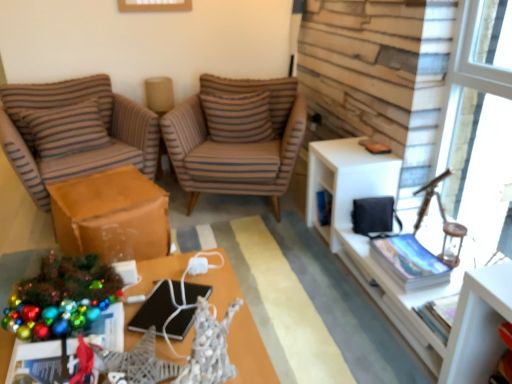
Question: Is brown striped fabric chair at center, arranged as the first chair when viewed from the right, completely or partially inside brown striped pillow at center, the first pillow in the right-to-left sequence?

Choices:
 (A) yes
 (B) no

Answer: (B)

Question: Can you confirm if brown striped pillow at center, the first pillow in the right-to-left sequence, is taller than brown striped fabric chair at center, arranged as the first chair when viewed from the right?

Choices:
 (A) yes
 (B) no

Answer: (B)

Question: Is brown striped pillow at center, the first pillow in the right-to-left sequence, wider than brown striped fabric chair at center, acting as the 2th chair starting from the left?

Choices:
 (A) yes
 (B) no

Answer: (B)

Question: Is brown striped pillow at center, the first pillow in the right-to-left sequence, thinner than brown striped fabric chair at center, arranged as the first chair when viewed from the right?

Choices:
 (A) yes
 (B) no

Answer: (A)

Question: Is brown striped pillow at center, which is the second pillow in left-to-right order, facing away from brown striped fabric chair at center, arranged as the first chair when viewed from the right?

Choices:
 (A) yes
 (B) no

Answer: (A)

Question: From a real-world perspective, is brown striped pillow at center, which is the second pillow in left-to-right order, beneath brown striped fabric chair at center, acting as the 2th chair starting from the left?

Choices:
 (A) yes
 (B) no

Answer: (B)

Question: From the image's perspective, is brown striped fabric chair at left, acting as the first chair starting from the left, located beneath brown striped pillow at center, which is the second pillow in left-to-right order?

Choices:
 (A) no
 (B) yes

Answer: (B)

Question: Is brown striped fabric chair at left, positioned as the second chair in right-to-left order, bigger than brown striped pillow at center, the first pillow in the right-to-left sequence?

Choices:
 (A) no
 (B) yes

Answer: (B)

Question: From a real-world perspective, is brown striped fabric chair at left, positioned as the second chair in right-to-left order, located higher than brown striped pillow at center, the first pillow in the right-to-left sequence?

Choices:
 (A) yes
 (B) no

Answer: (B)

Question: Can you confirm if brown striped fabric chair at left, acting as the first chair starting from the left, is thinner than brown striped pillow at center, the first pillow in the right-to-left sequence?

Choices:
 (A) no
 (B) yes

Answer: (A)

Question: Is brown striped fabric chair at left, positioned as the second chair in right-to-left order, further to camera compared to brown striped pillow at center, which is the second pillow in left-to-right order?

Choices:
 (A) no
 (B) yes

Answer: (A)

Question: Would you say brown striped fabric chair at left, positioned as the second chair in right-to-left order, is outside brown striped pillow at center, the first pillow in the right-to-left sequence?

Choices:
 (A) yes
 (B) no

Answer: (A)

Question: Can you confirm if brown striped fabric chair at left, positioned as the second chair in right-to-left order, is smaller than metallic silver desk at center?

Choices:
 (A) yes
 (B) no

Answer: (B)